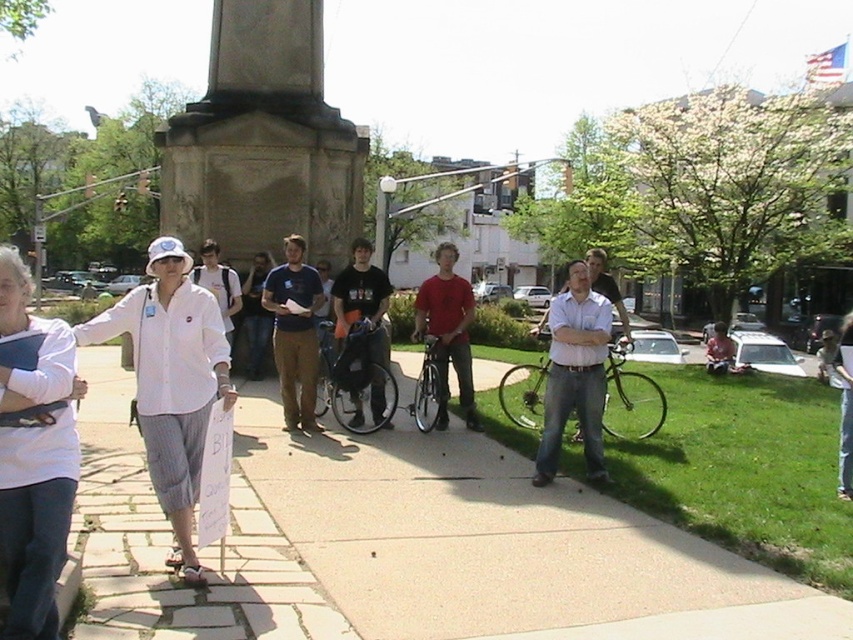
Question: Is gray stone monument at center wider than white cotton shirt at center?

Choices:
 (A) yes
 (B) no

Answer: (B)

Question: Which point is farther to the camera?

Choices:
 (A) (270, 397)
 (B) (230, 348)
 (C) (444, 346)
 (D) (577, 392)

Answer: (A)

Question: Does gray stone monument at center appear on the right side of white cotton shirt at center?

Choices:
 (A) no
 (B) yes

Answer: (B)

Question: Which point is farther to the camera?

Choices:
 (A) pyautogui.click(x=16, y=572)
 (B) pyautogui.click(x=306, y=51)
 (C) pyautogui.click(x=219, y=269)

Answer: (B)

Question: Which object appears closest to the camera in this image?

Choices:
 (A) white cotton shirt at left
 (B) white cotton shirt at center
 (C) dark blue t-shirt at center
 (D) white matte shirt at center

Answer: (A)

Question: Can you confirm if white cotton shirt at center is smaller than matte red shirt at center?

Choices:
 (A) yes
 (B) no

Answer: (A)